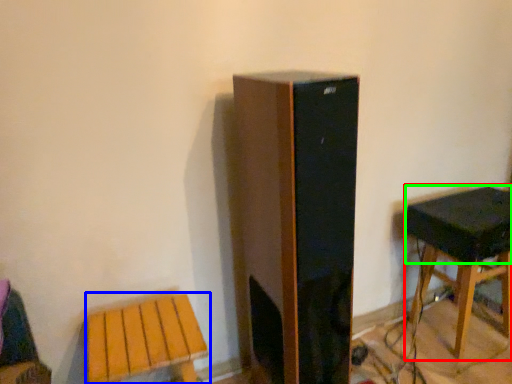
Question: Based on their relative distances, which object is farther from stool (highlighted by a red box)? Choose from stool (highlighted by a blue box) and speaker (highlighted by a green box).

Choices:
 (A) stool
 (B) speaker

Answer: (A)